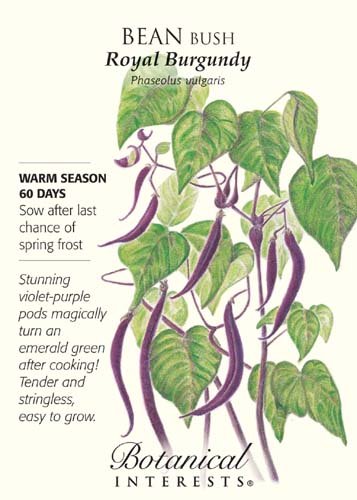
Where is `poster`? The height and width of the screenshot is (500, 357). poster is located at coordinates (58, 371).